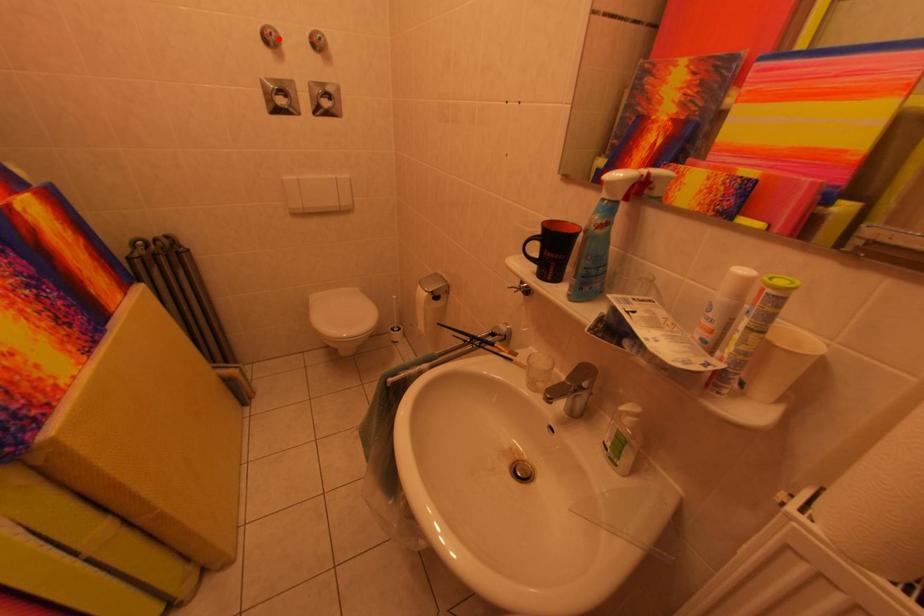
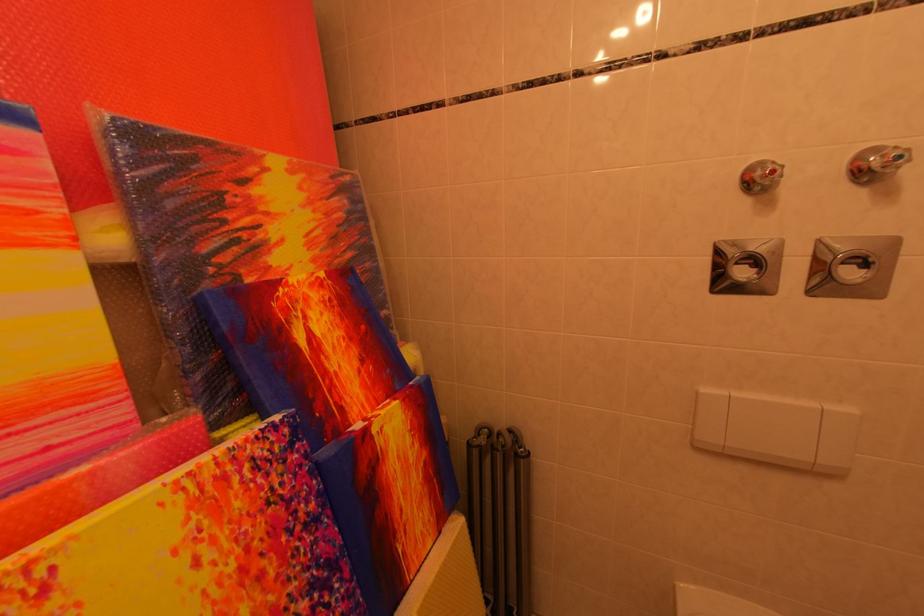
Find the pixel in the second image that matches the highlighted location in the first image.

(782, 176)